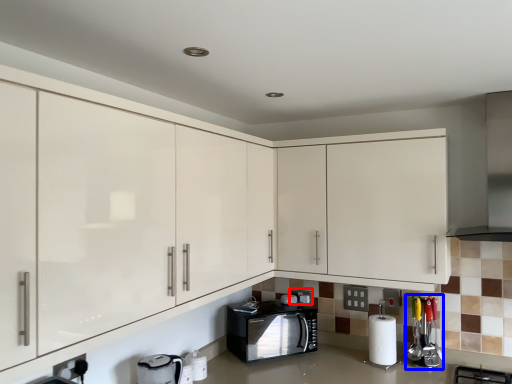
Question: Which of the following is the closest to the observer, appliance (highlighted by a red box) or appliance (highlighted by a blue box)?

Choices:
 (A) appliance
 (B) appliance

Answer: (B)